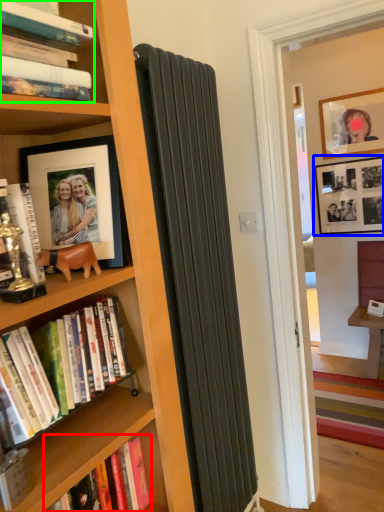
Question: Which is farther away from book (highlighted by a red box)? picture frame (highlighted by a blue box) or book (highlighted by a green box)?

Choices:
 (A) picture frame
 (B) book

Answer: (A)